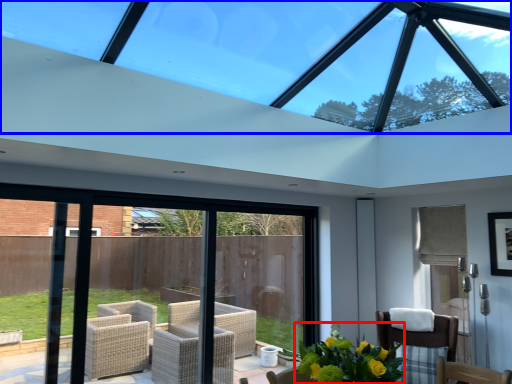
Question: Which object is closer to the camera taking this photo, floral arrangement (highlighted by a red box) or window (highlighted by a blue box)?

Choices:
 (A) floral arrangement
 (B) window

Answer: (B)